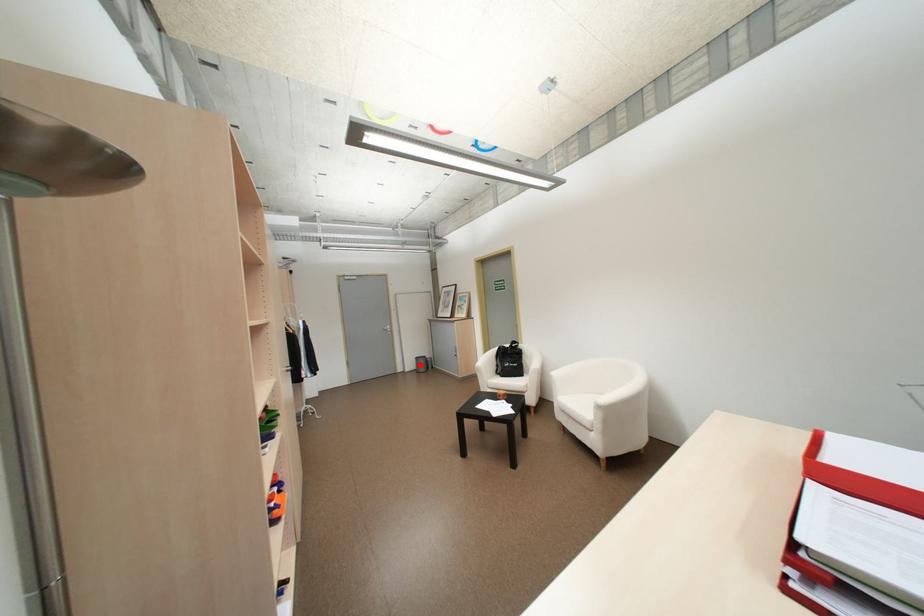
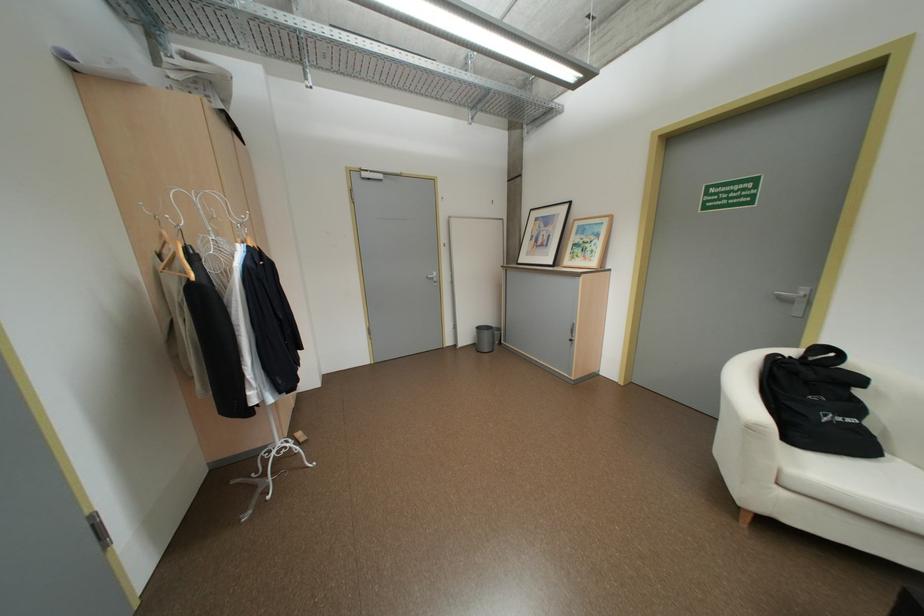
Where in the second image is the point corresponding to the highlighted location from the first image?

(476, 338)